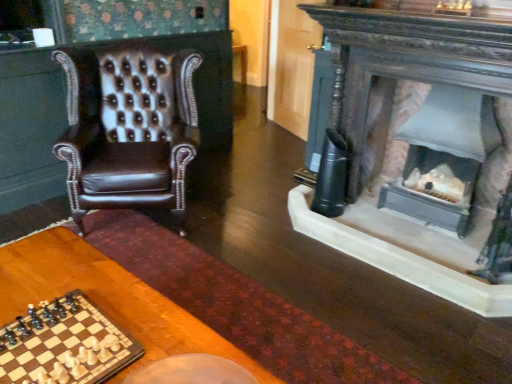
Where is `empty space that is ontop of wooden chessboard at lower left (from a real-world perspective)`? empty space that is ontop of wooden chessboard at lower left (from a real-world perspective) is located at coordinates (57, 348).